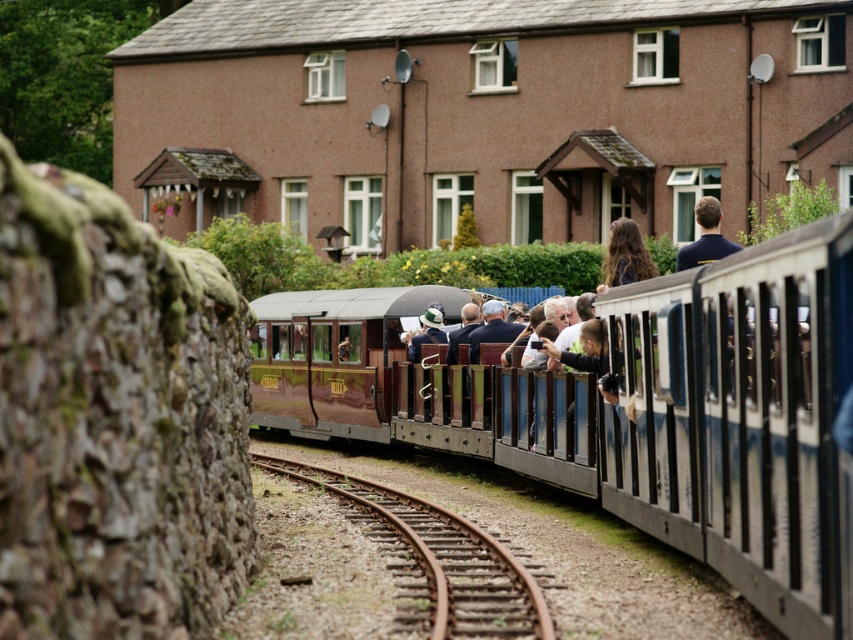
Is mahogany polished wood train at center to the left of light brown wooden fence at center from the viewer's perspective?

Correct, you'll find mahogany polished wood train at center to the left of light brown wooden fence at center.

What do you see at coordinates (657, 417) in the screenshot? The width and height of the screenshot is (853, 640). I see `mahogany polished wood train at center` at bounding box center [657, 417].

Which is behind, point (846, 276) or point (593, 342)?

Point (593, 342)

This screenshot has width=853, height=640. I want to click on mahogany polished wood train at center, so click(657, 417).

Can you confirm if mahogany polished wood train at center is positioned above green fabric hat at center?

Actually, mahogany polished wood train at center is below green fabric hat at center.

Is mahogany polished wood train at center bigger than green fabric hat at center?

Yes.

Is point (558, 385) positioned in front of point (426, 310)?

Yes, point (558, 385) is closer to viewer.

Where is `mahogany polished wood train at center`? The width and height of the screenshot is (853, 640). mahogany polished wood train at center is located at coordinates (657, 417).

Between point (582, 349) and point (428, 332), which one is positioned in front?

Point (582, 349) is more forward.

Looking at this image, is light brown wooden fence at center to the right of green fabric hat at center from the viewer's perspective?

Indeed, light brown wooden fence at center is positioned on the right side of green fabric hat at center.

You are a GUI agent. You are given a task and a screenshot of the screen. Output one action in this format:
    pyautogui.click(x=<x>, y=<y>)
    Task: Click on the light brown wooden fence at center
    This screenshot has height=640, width=853.
    Given the screenshot: What is the action you would take?
    (590, 356)